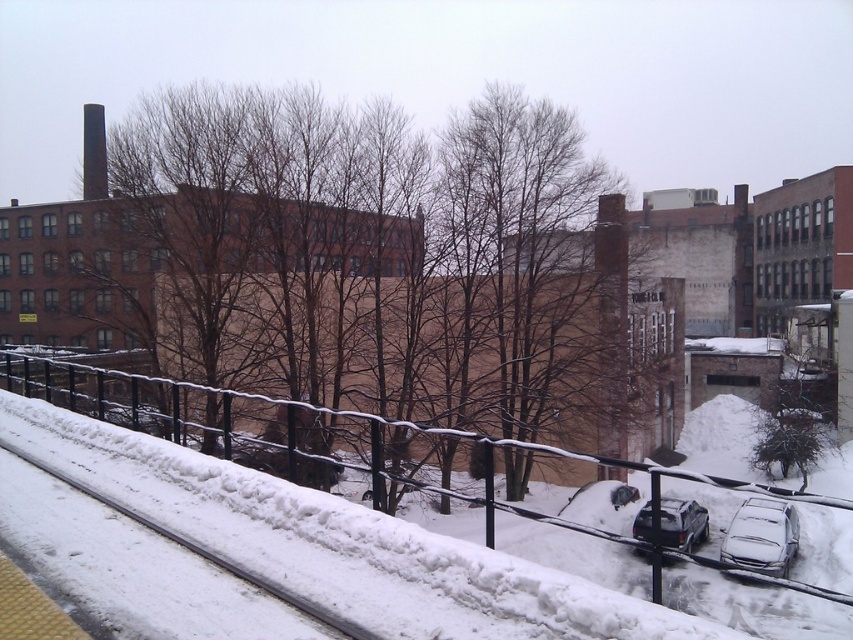
Does point (322, 624) come closer to viewer compared to point (706, 522)?

Yes, point (322, 624) is closer to viewer.

Is point (189, 545) farther from camera compared to point (670, 541)?

No, (189, 545) is in front of (670, 541).

Identify the location of snow-covered metal train track at lower left. (206, 552).

Who is taller, sleek silver sedan at lower right or satin black suv at lower right?

satin black suv at lower right is taller.

Is sleek silver sedan at lower right thinner than satin black suv at lower right?

Yes, sleek silver sedan at lower right is thinner than satin black suv at lower right.

Is point (793, 531) positioned in front of point (680, 550)?

No, (793, 531) is behind (680, 550).

Locate an element on the screen. The image size is (853, 640). sleek silver sedan at lower right is located at coordinates (762, 536).

Is sleek silver sedan at lower right above snow-covered metal train track at lower left?

Actually, sleek silver sedan at lower right is below snow-covered metal train track at lower left.

Is point (727, 561) positioned in front of point (1, 444)?

No, (727, 561) is further to viewer.

Find the location of a particular element. The width and height of the screenshot is (853, 640). sleek silver sedan at lower right is located at coordinates (762, 536).